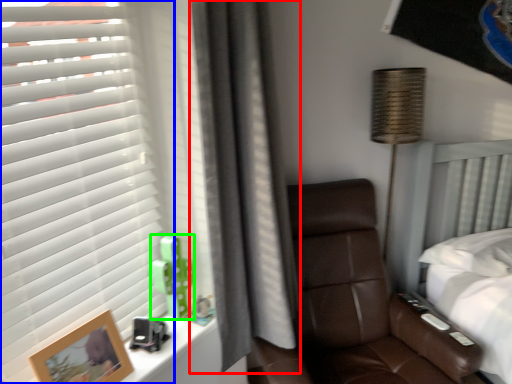
Question: Which is nearer to the curtain (highlighted by a red box)? window blind (highlighted by a blue box) or toy (highlighted by a green box).

Choices:
 (A) window blind
 (B) toy

Answer: (B)